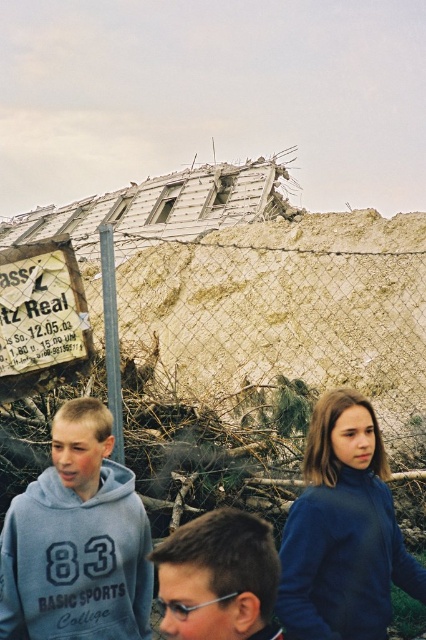
You are a photographer trying to capture a clear shot of the blue fleece jacket at center and the dark brown hair at center through the chain link fence. Since the fence is in the way, you need to adjust your position to get both subjects in frame. Considering the size difference between the two subjects, which one might require more careful framing to ensure it is fully visible?

The blue fleece jacket at center has a larger width than the dark brown hair at center, so it might require more careful framing to ensure it is fully visible.

You are a surveyor standing 50 meters away from the scene behind a chain link fence. You need to measure the distance to the gray fleece sweatshirt at center. Can you reach it with a 50 meter measuring tape?

The gray fleece sweatshirt at center is 43.93 meters away from the camera, so yes, the 50 meter measuring tape can reach it since it is shorter than the tape length.